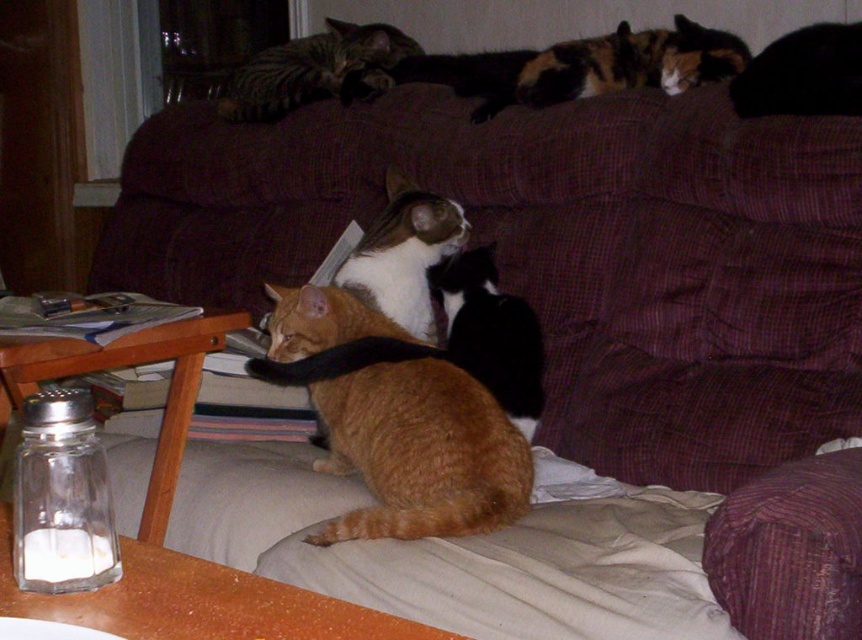
Identify the location of orange fur cat at center. (420, 452).

Does orange fur cat at center have a larger size compared to calico fur cat at upper center?

Correct, orange fur cat at center is larger in size than calico fur cat at upper center.

Measure the distance between point (422, 529) and camera.

4.65 feet

Where is `orange fur cat at center`? The image size is (862, 640). orange fur cat at center is located at coordinates (420, 452).

Between calico fur cat at upper center and black and white fur at center, which one appears on the left side from the viewer's perspective?

From the viewer's perspective, black and white fur at center appears more on the left side.

Who is higher up, calico fur cat at upper center or black and white fur at center?

calico fur cat at upper center

Where is `calico fur cat at upper center`? calico fur cat at upper center is located at coordinates (629, 61).

Who is positioned more to the left, orange fur cat at center or black and white fur at center?

Positioned to the left is orange fur cat at center.

The image size is (862, 640). Find the location of `orange fur cat at center`. orange fur cat at center is located at coordinates (420, 452).

Find the location of a particular element. Image resolution: width=862 pixels, height=640 pixels. orange fur cat at center is located at coordinates point(420,452).